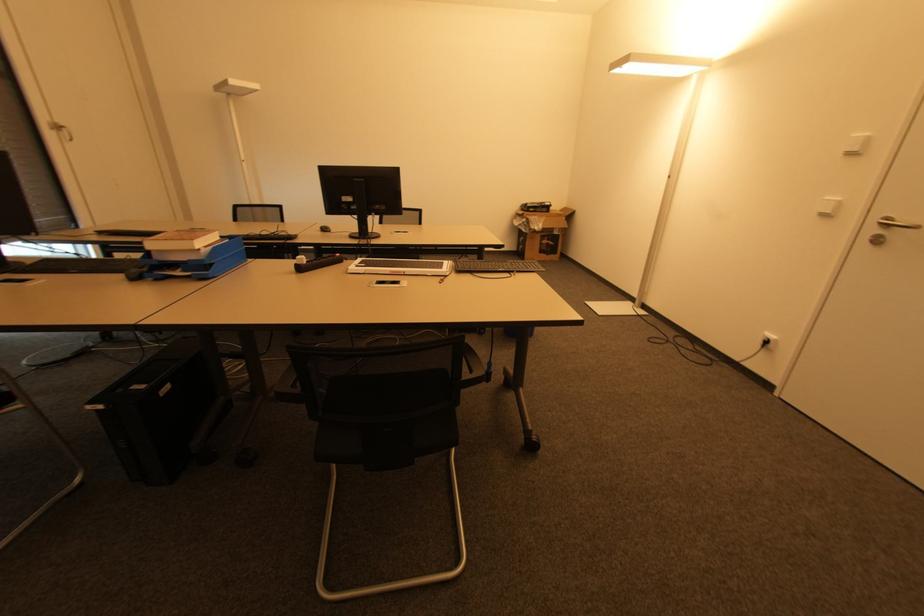
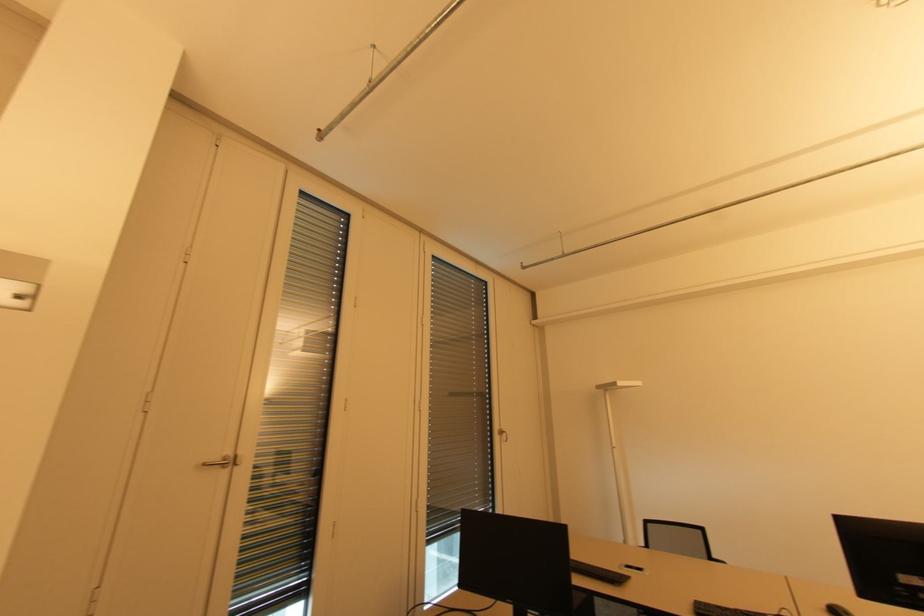
The point at [55,130] is marked in the first image. Where is the corresponding point in the second image?

(501, 435)